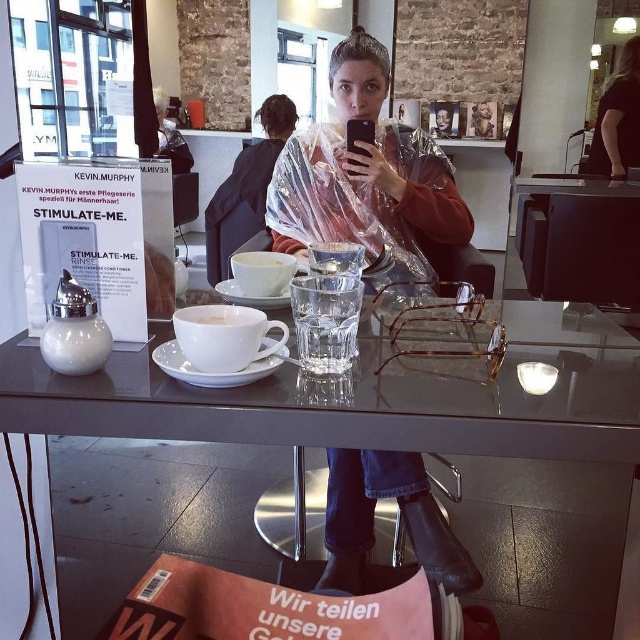
You are a delivery person who needs to place a small package between the transparent plastic poncho at center and the white ceramic cup at center. The package is 1.0 meters long. Will it fit in the space between them?

The transparent plastic poncho at center and white ceramic cup at center are 1.02 meters apart. Since the package is 1.0 meters long, it will fit in the space between them as the distance is slightly larger than the package length.

You are a customer in a hair salon and want to place your phone on the table between the transparent plastic poncho at center and the white ceramic cup at center. Is there enough space between them to place your phone?

The transparent plastic poncho at center is to the right of the white ceramic cup at center, so there is space between them to place your phone.